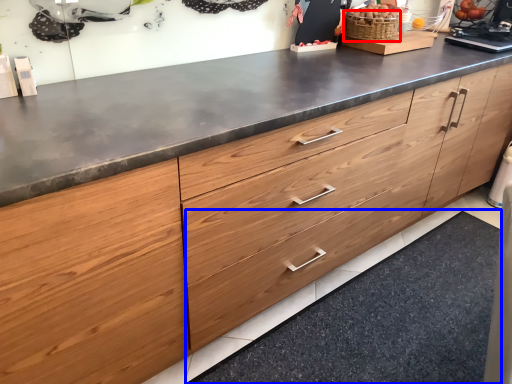
Question: Which object is closer to the camera taking this photo, basket (highlighted by a red box) or granite (highlighted by a blue box)?

Choices:
 (A) basket
 (B) granite

Answer: (B)